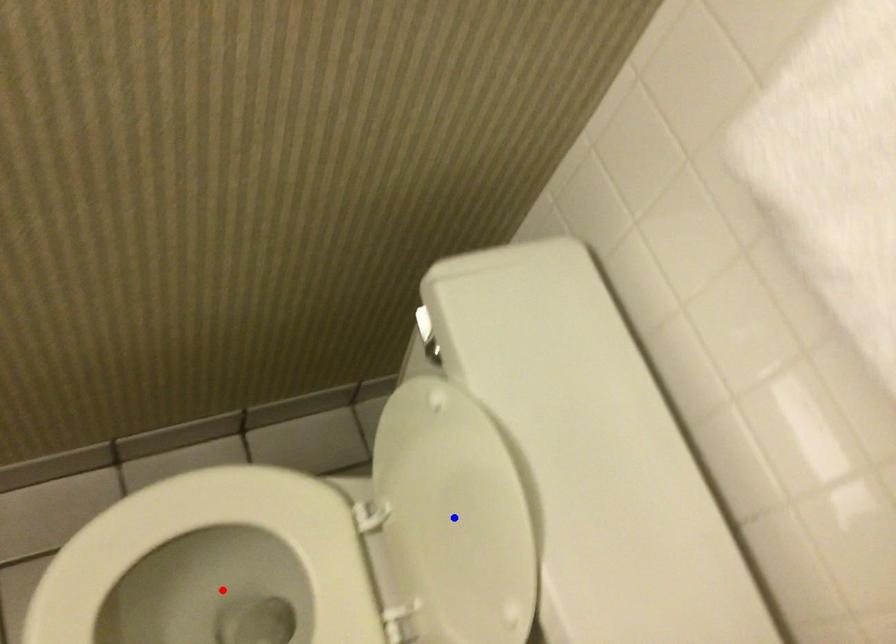
Question: Two points are marked on the image. Which point is closer to the camera?

Choices:
 (A) Blue point is closer.
 (B) Red point is closer.

Answer: (A)